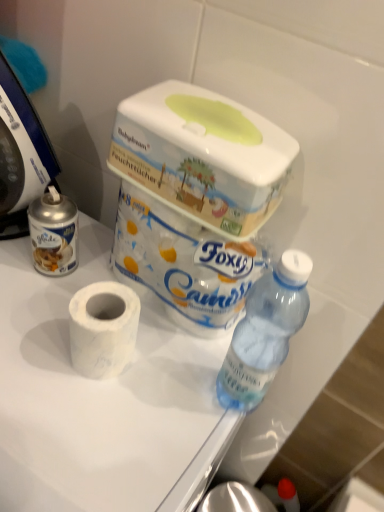
Question: Does white matte toilet paper at center, which ranks as the second toilet paper in top-to-bottom order, contain white marble toilet paper at center, arranged as the second toilet paper when ordered from the bottom?

Choices:
 (A) yes
 (B) no

Answer: (B)

Question: From a real-world perspective, is white matte toilet paper at center, which is the 1th toilet paper from bottom to top, physically below white marble toilet paper at center, which is the 1th toilet paper in top-to-bottom order?

Choices:
 (A) no
 (B) yes

Answer: (B)

Question: From the image's perspective, is white matte toilet paper at center, which is the 1th toilet paper from bottom to top, below white marble toilet paper at center, arranged as the second toilet paper when ordered from the bottom?

Choices:
 (A) no
 (B) yes

Answer: (B)

Question: Considering the relative sizes of white matte toilet paper at center, which is the 1th toilet paper from bottom to top, and white marble toilet paper at center, which is the 1th toilet paper in top-to-bottom order, in the image provided, is white matte toilet paper at center, which is the 1th toilet paper from bottom to top, smaller than white marble toilet paper at center, which is the 1th toilet paper in top-to-bottom order,?

Choices:
 (A) yes
 (B) no

Answer: (A)

Question: Considering the relative sizes of white matte toilet paper at center, which ranks as the second toilet paper in top-to-bottom order, and white marble toilet paper at center, which is the 1th toilet paper in top-to-bottom order, in the image provided, is white matte toilet paper at center, which ranks as the second toilet paper in top-to-bottom order, wider than white marble toilet paper at center, which is the 1th toilet paper in top-to-bottom order,?

Choices:
 (A) no
 (B) yes

Answer: (A)

Question: Looking at their shapes, would you say white plastic box at upper center is wider or thinner than white matte toilet paper at center?

Choices:
 (A) thin
 (B) wide

Answer: (A)

Question: In terms of height, does white plastic box at upper center look taller or shorter compared to white matte toilet paper at center?

Choices:
 (A) tall
 (B) short

Answer: (B)

Question: Considering their positions, is white plastic box at upper center located in front of or behind white matte toilet paper at center?

Choices:
 (A) behind
 (B) front

Answer: (A)

Question: In the image, is white plastic box at upper center on the left side or the right side of white matte toilet paper at center?

Choices:
 (A) left
 (B) right

Answer: (B)

Question: Considering their positions, is blue plastic food processor at left located in front of or behind white plastic box at upper center?

Choices:
 (A) behind
 (B) front

Answer: (B)

Question: Is blue plastic food processor at left taller or shorter than white plastic box at upper center?

Choices:
 (A) tall
 (B) short

Answer: (A)

Question: From the image's perspective, is blue plastic food processor at left located above or below white plastic box at upper center?

Choices:
 (A) above
 (B) below

Answer: (A)

Question: Based on their sizes in the image, would you say blue plastic food processor at left is bigger or smaller than white plastic box at upper center?

Choices:
 (A) big
 (B) small

Answer: (A)

Question: In terms of height, does blue plastic food processor at left look taller or shorter compared to white matte toilet paper at center, which ranks as the second toilet paper in top-to-bottom order?

Choices:
 (A) short
 (B) tall

Answer: (B)

Question: Based on their positions, is blue plastic food processor at left located to the left or right of white matte toilet paper at center, which ranks as the second toilet paper in top-to-bottom order?

Choices:
 (A) left
 (B) right

Answer: (A)